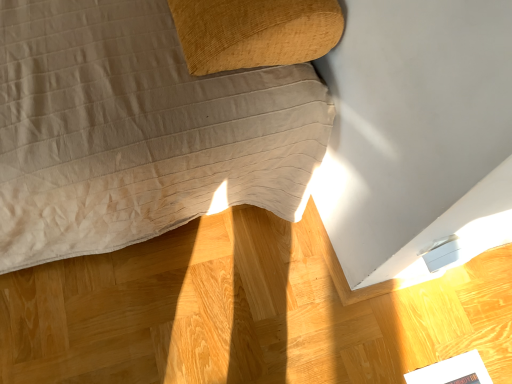
Measure the distance between point (435, 375) and camera.

Point (435, 375) is 3.38 feet away from camera.

Describe the element at coordinates (452, 371) in the screenshot. I see `white glossy magazine at lower right` at that location.

Locate an element on the screen. white glossy magazine at lower right is located at coordinates (452, 371).

Measure the distance between point [16,198] and camera.

Point [16,198] is 29.80 inches from camera.

What do you see at coordinates (136, 130) in the screenshot? This screenshot has width=512, height=384. I see `wooden table at center` at bounding box center [136, 130].

You are a GUI agent. You are given a task and a screenshot of the screen. Output one action in this format:
    pyautogui.click(x=<x>, y=<y>)
    Task: Click on the wooden table at center
    
    Given the screenshot: What is the action you would take?
    pyautogui.click(x=136, y=130)

This screenshot has width=512, height=384. In order to click on white glossy magazine at lower right in this screenshot , I will do `click(452, 371)`.

Is white glossy magazine at lower right at the left side of wooden table at center?

No.

Is white glossy magazine at lower right in front of or behind wooden table at center in the image?

Clearly, white glossy magazine at lower right is behind wooden table at center.

Considering the positions of points (455, 361) and (138, 225), is point (455, 361) farther from camera compared to point (138, 225)?

Yes, point (455, 361) is farther from viewer.

From the image's perspective, is white glossy magazine at lower right located above wooden table at center?

Actually, white glossy magazine at lower right appears below wooden table at center in the image.

From a real-world perspective, which is physically below, white glossy magazine at lower right or wooden table at center?

white glossy magazine at lower right is physically lower.

Considering the sizes of white glossy magazine at lower right and wooden table at center in the image, is white glossy magazine at lower right wider or thinner than wooden table at center?

In the image, white glossy magazine at lower right appears to be more narrow than wooden table at center.

Based on the photo, can you confirm if white glossy magazine at lower right is taller than wooden table at center?

No.

Who is smaller, white glossy magazine at lower right or wooden table at center?

white glossy magazine at lower right.

Is wooden table at center a part of white glossy magazine at lower right?

No, wooden table at center is not inside white glossy magazine at lower right.

Is white glossy magazine at lower right not close to wooden table at center?

No.

Could you tell me if white glossy magazine at lower right is turned towards wooden table at center?

No, white glossy magazine at lower right is not oriented towards wooden table at center.

You are a GUI agent. You are given a task and a screenshot of the screen. Output one action in this format:
    pyautogui.click(x=<x>, y=<y>)
    Task: Click on the furniture above the white glossy magazine at lower right (from a real-world perspective)
    This screenshot has width=512, height=384.
    Given the screenshot: What is the action you would take?
    pyautogui.click(x=136, y=130)

Is wooden table at center to the right of white glossy magazine at lower right from the viewer's perspective?

Incorrect, wooden table at center is not on the right side of white glossy magazine at lower right.

Which object is closer to the camera, wooden table at center or white glossy magazine at lower right?

wooden table at center is closer to the camera.

Is point (192, 99) closer or farther from the camera than point (472, 365)?

Point (192, 99) is closer to the camera than point (472, 365).

From the image's perspective, is wooden table at center below white glossy magazine at lower right?

No, from the image's perspective, wooden table at center is not beneath white glossy magazine at lower right.

From a real-world perspective, is wooden table at center positioned under white glossy magazine at lower right based on gravity?

No, from a real-world perspective, wooden table at center is not beneath white glossy magazine at lower right.

Is wooden table at center thinner than white glossy magazine at lower right?

No.

Which of these two, wooden table at center or white glossy magazine at lower right, stands taller?

With more height is wooden table at center.

Considering the relative sizes of wooden table at center and white glossy magazine at lower right in the image provided, is wooden table at center bigger than white glossy magazine at lower right?

Yes.

Is white glossy magazine at lower right completely or partially inside wooden table at center?

That's incorrect, white glossy magazine at lower right is not inside wooden table at center.

Is wooden table at center not near white glossy magazine at lower right?

That's not correct — wooden table at center is a little close to white glossy magazine at lower right.

Is wooden table at center aimed at white glossy magazine at lower right?

Yes, wooden table at center is turned towards white glossy magazine at lower right.

Where is `furniture located above the white glossy magazine at lower right (from the image's perspective)`? The image size is (512, 384). furniture located above the white glossy magazine at lower right (from the image's perspective) is located at coordinates (136, 130).

This screenshot has height=384, width=512. I want to click on furniture that appears in front of the white glossy magazine at lower right, so click(x=136, y=130).

Identify the location of magazine beneath the wooden table at center (from a real-world perspective). The height and width of the screenshot is (384, 512). (452, 371).